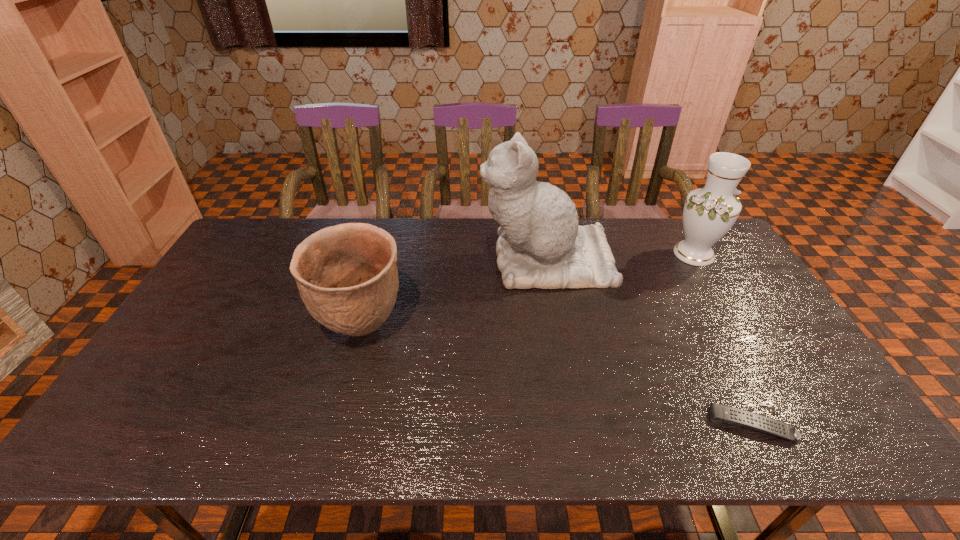
Where is `vacant space at the far edge of the desktop`? The image size is (960, 540). vacant space at the far edge of the desktop is located at coordinates (492, 239).

In the image, there is a desktop. Where is `vacant space at the near edge`? This screenshot has height=540, width=960. vacant space at the near edge is located at coordinates (438, 436).

Where is `free region at the left edge`? free region at the left edge is located at coordinates (159, 373).

In the image, there is a desktop. What are the coordinates of `vacant area at the right edge` in the screenshot? It's located at (812, 368).

Where is `empty space that is in between the third farthest object and the vase`? empty space that is in between the third farthest object and the vase is located at coordinates (528, 291).

Image resolution: width=960 pixels, height=540 pixels. What are the coordinates of `empty space that is in between the vase and the nearest object` in the screenshot? It's located at (723, 339).

Find the location of a particular element. free space that is in between the second tallest object and the shortest object is located at coordinates (723, 339).

Where is `free area in between the pottery and the remote control`? Image resolution: width=960 pixels, height=540 pixels. free area in between the pottery and the remote control is located at coordinates (557, 376).

Locate an element on the screen. blank region between the nearest object and the third object from right to left is located at coordinates (649, 342).

Where is `vacant space in between the nearest object and the third object from right to left`? This screenshot has height=540, width=960. vacant space in between the nearest object and the third object from right to left is located at coordinates coord(649,342).